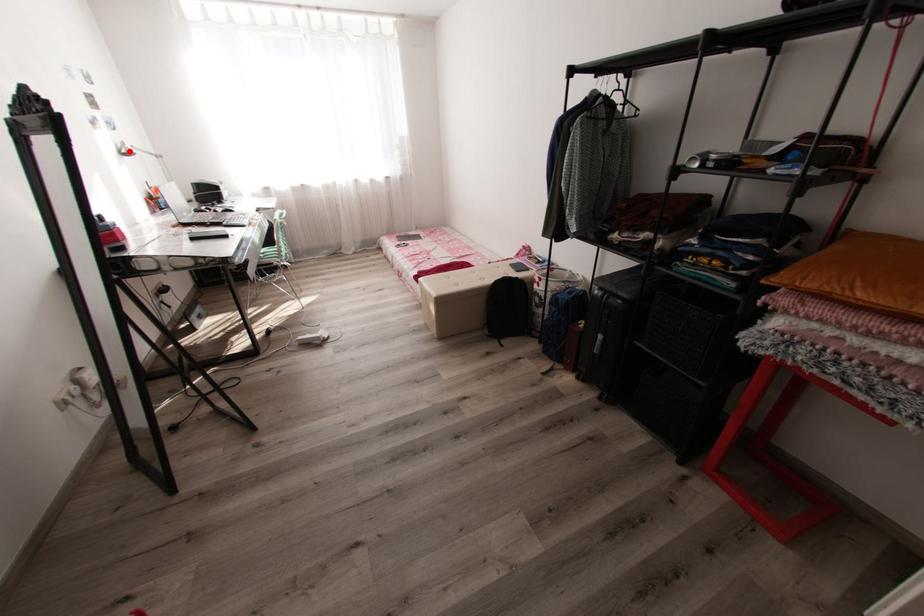
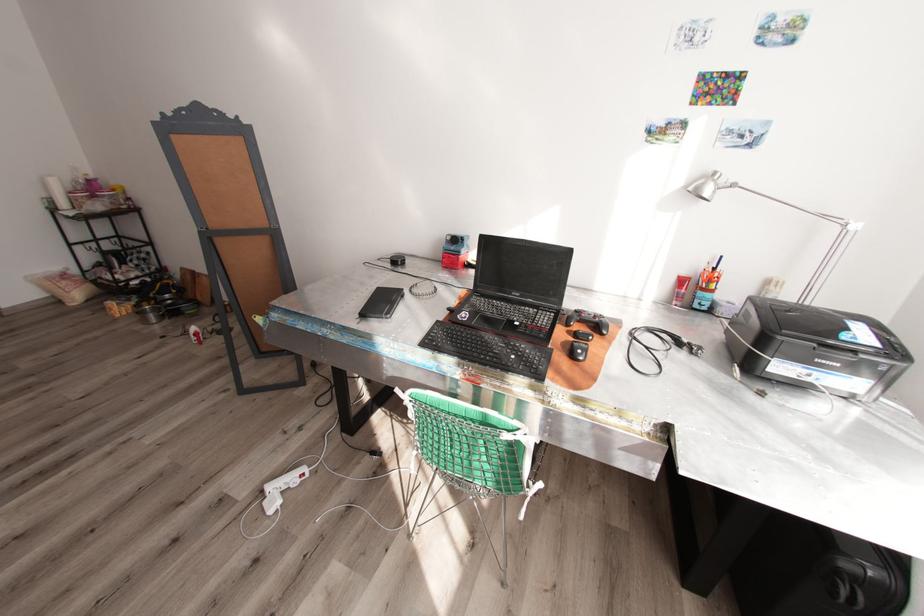
Question: I am providing you with two images of the same scene from different viewpoints. A red point is marked on the first image. Can you still see the location of the red point in image 2?

Choices:
 (A) Yes
 (B) No

Answer: (A)